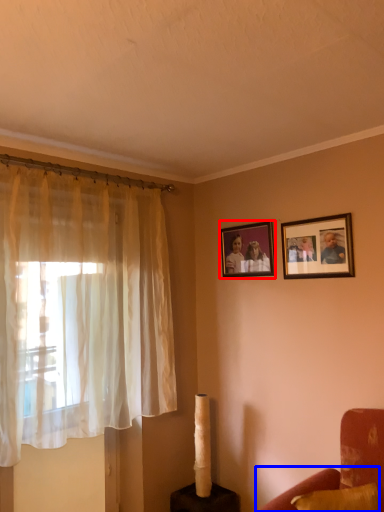
Question: Which of the following is the closest to the observer, picture frame (highlighted by a red box) or couch (highlighted by a blue box)?

Choices:
 (A) picture frame
 (B) couch

Answer: (B)